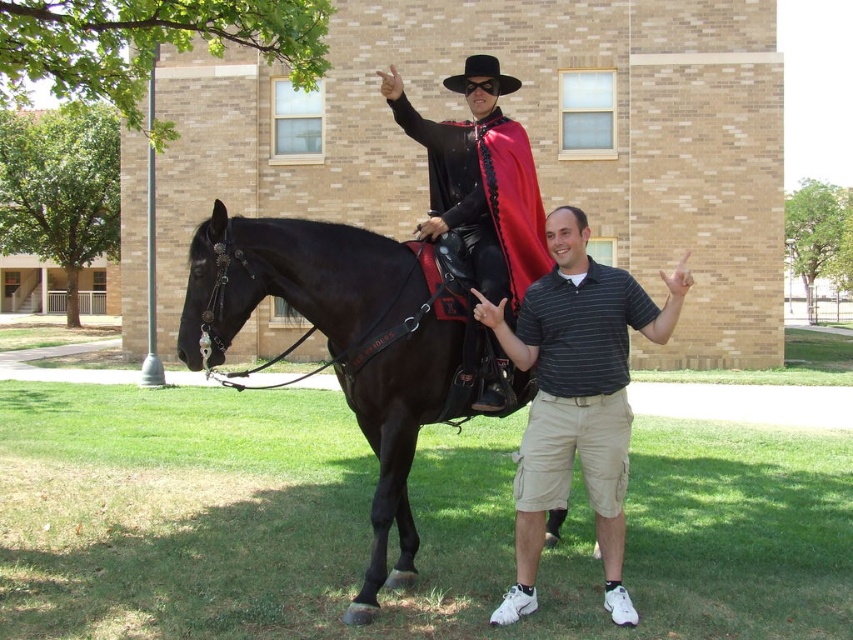
You are standing in the scene and want to walk from the shiny black horse at center to the khaki cargo shorts at lower right. Which direction should you face to walk directly towards them?

You should face to the right because the khaki cargo shorts at lower right are positioned to the right of the shiny black horse at center.

From the picture: You are a photographer standing at the edge of the grassy area. You want to take a photo of the khaki cargo shorts at lower right and the shiny black cape at center. If your camera can focus on objects within a 25 inch range, will both items be in focus?

The khaki cargo shorts at lower right is 25.87 inches away from the shiny black cape at center. Since the distance between them exceeds the camera focus range of 25 inches, both items may not be in focus simultaneously.

You are a photographer trying to capture the shiny black horse at center and the shiny black cape at center in a single shot. Based on their positions, which object should you focus on first to ensure both are in frame?

The shiny black horse at center is below the shiny black cape at center, so you should focus on the shiny black horse at center first to ensure both are in frame.